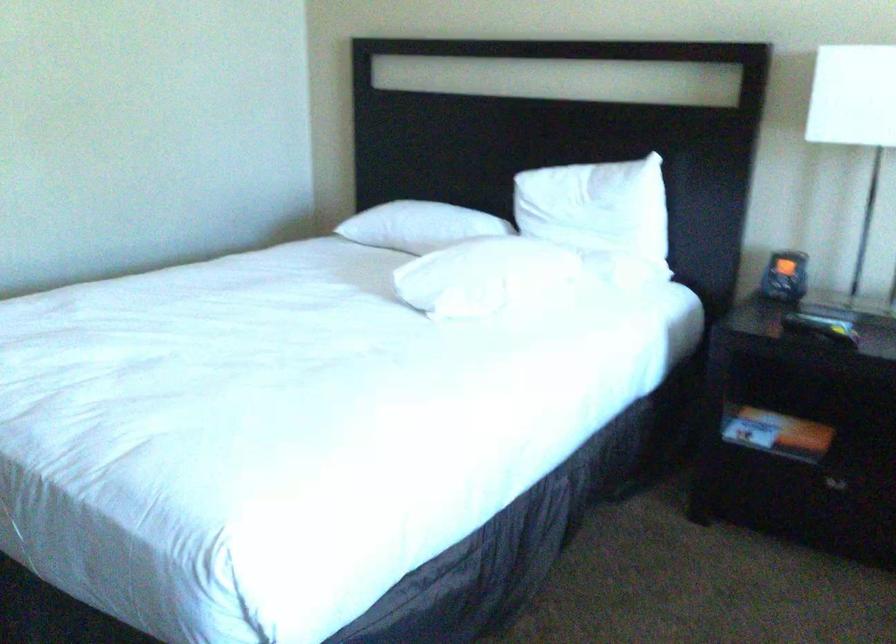
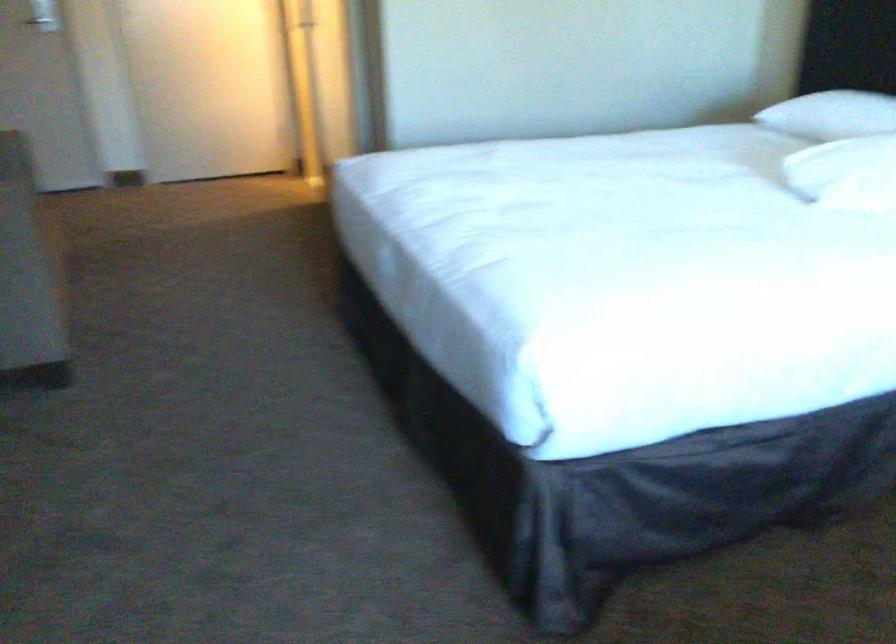
Question: The camera is either moving clockwise (left) or counter-clockwise (right) around the object. The first image is from the beginning of the video and the second image is from the end. Is the camera moving left or right when shooting the video?

Choices:
 (A) Left
 (B) Right

Answer: (B)